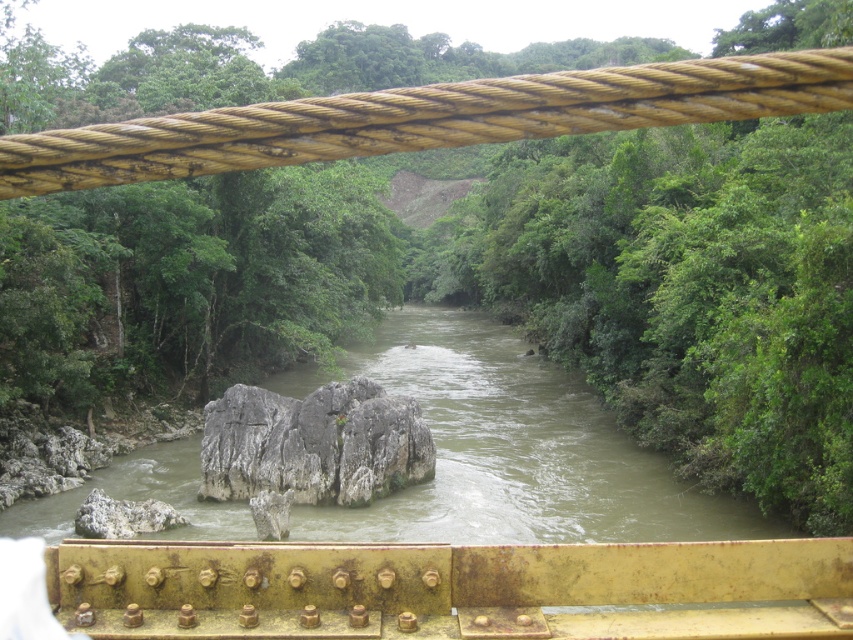
Is brown muddy water at center to the right of gray rough rock at center from the viewer's perspective?

Indeed, brown muddy water at center is positioned on the right side of gray rough rock at center.

Between brown muddy water at center and gray rough rock at center, which one appears on the left side from the viewer's perspective?

gray rough rock at center

You are a GUI agent. You are given a task and a screenshot of the screen. Output one action in this format:
    pyautogui.click(x=<x>, y=<y>)
    Task: Click on the brown muddy water at center
    
    Given the screenshot: What is the action you would take?
    pyautogui.click(x=515, y=451)

Can you confirm if brown muddy water at center is positioned below rusty yellow rope at upper center?

Correct, brown muddy water at center is located below rusty yellow rope at upper center.

Between brown muddy water at center and rusty yellow rope at upper center, which one is positioned lower?

brown muddy water at center

Which is in front, point (643, 536) or point (12, 173)?

Point (12, 173) is in front.

This screenshot has height=640, width=853. Identify the location of brown muddy water at center. (515, 451).

Which of these two, rusty yellow rope at upper center or gray rough rock at center, stands shorter?

Standing shorter between the two is gray rough rock at center.

Between rusty yellow rope at upper center and gray rough rock at center, which one appears on the right side from the viewer's perspective?

From the viewer's perspective, rusty yellow rope at upper center appears more on the right side.

Does point (740, 97) come in front of point (331, 472)?

Yes, it is in front of point (331, 472).

This screenshot has height=640, width=853. I want to click on rusty yellow rope at upper center, so click(426, 118).